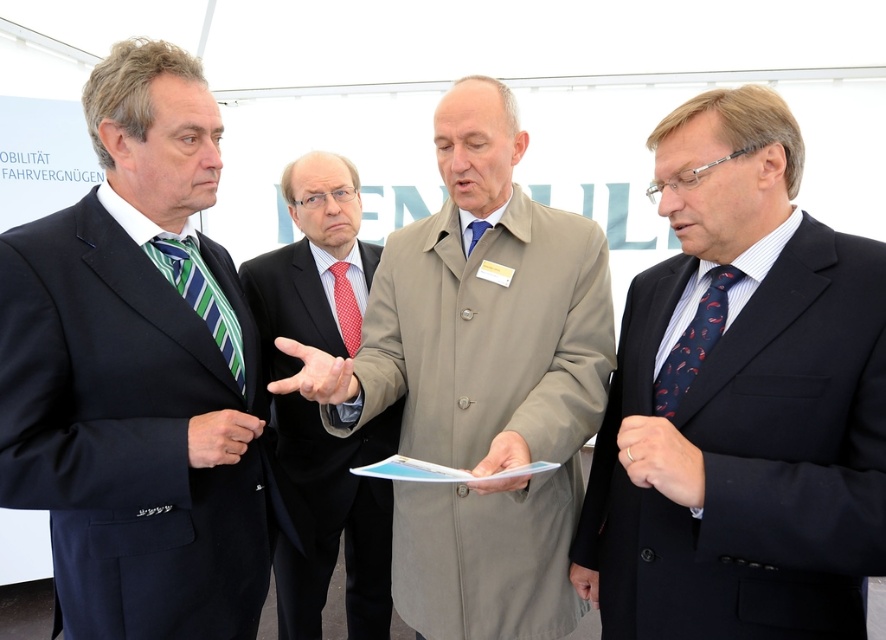
Describe the element at coordinates (137, 374) in the screenshot. This screenshot has width=886, height=640. I see `dark blue suit at left` at that location.

Does dark blue suit at left appear over polished dark suit at center?

Correct, dark blue suit at left is located above polished dark suit at center.

Who is more distant from viewer, (99, 88) or (362, 493)?

The point (362, 493) is behind.

This screenshot has width=886, height=640. I want to click on dark blue suit at left, so click(137, 374).

Is point (412, 618) farther from camera compared to point (378, 547)?

No, it is in front of (378, 547).

Where is `beige coat at center`? Image resolution: width=886 pixels, height=640 pixels. beige coat at center is located at coordinates (480, 381).

Which is behind, point (490, 268) or point (269, 308)?

The point (269, 308) is more distant.

Image resolution: width=886 pixels, height=640 pixels. I want to click on beige coat at center, so pos(480,381).

Consider the image. Can you confirm if green striped tie at left is bigger than red dotted tie at center?

Indeed, green striped tie at left has a larger size compared to red dotted tie at center.

Locate an element on the screen. green striped tie at left is located at coordinates (200, 296).